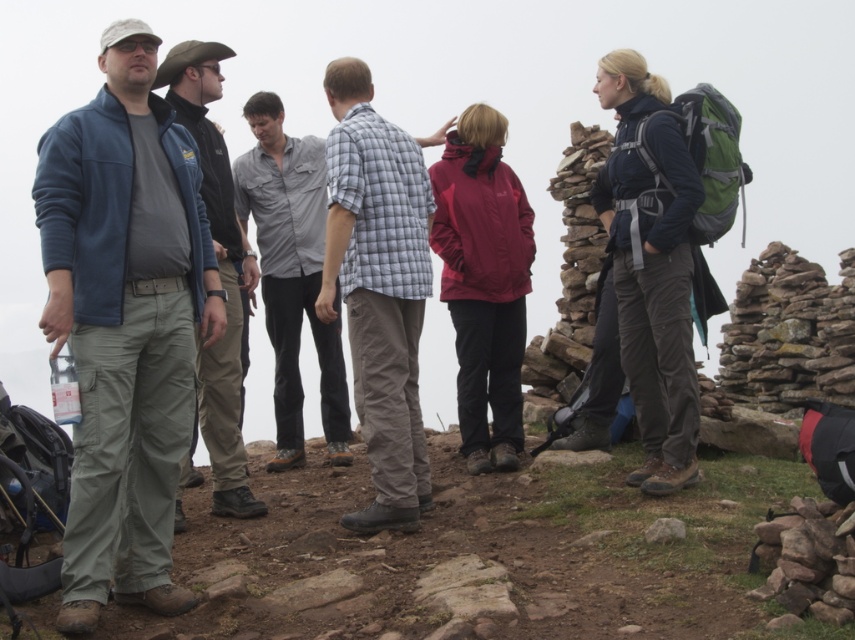
You are a drone operator tasked with capturing aerial footage of the group. You need to adjust your camera angle so that both the point at [624,106] and the point at [236,273] are visible in the frame. Considering their positions relative to you, which point should you focus on first to ensure both are in the shot?

Since point [624,106] is closer to the viewer than point [236,273], you should focus on point [624,106] first to ensure both points are within the frame.

Based on the photo, you are part of the hiking group and need to locate the dark blue fabric jacket at right. Based on the coordinates provided, where should you look relative to your current position?

The dark blue fabric jacket at right is located at point 0.420 on the x and 0.764 on the y axis. Since the coordinates are relative to the image, you should look towards the right side of the scene and slightly upwards to find the jacket.

You are a photographer trying to capture a photo of the group. You want to ensure both the matte blue jacket at left and the plaid cotton shirt at center are clearly visible. Which object should you focus on first to ensure both are in focus?

The matte blue jacket at left is closer to the viewer than the plaid cotton shirt at center. To ensure both are in focus, you should focus on the matte blue jacket at left first, as it is closer, and the depth of field may naturally include the plaid cotton shirt at center in the background.